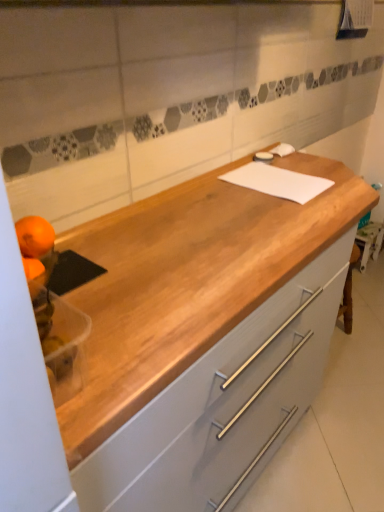
Where is `vacant space to the right of white matte cutting board at center`? vacant space to the right of white matte cutting board at center is located at coordinates (340, 180).